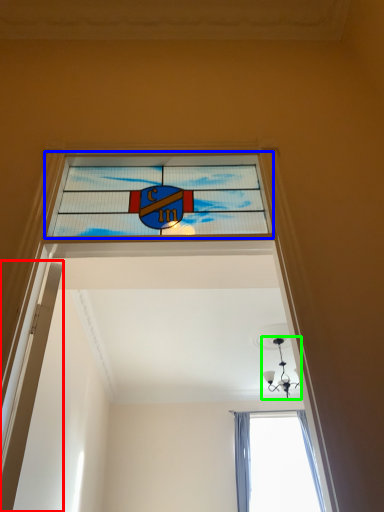
Question: Which object is positioned closest to door (highlighted by a red box)? Select from window (highlighted by a blue box) and light fixture (highlighted by a green box).

Choices:
 (A) window
 (B) light fixture

Answer: (A)